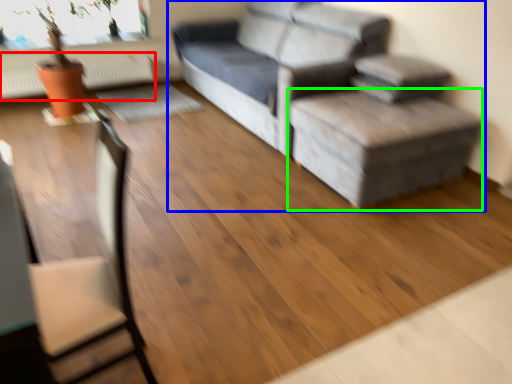
Question: Which object is the closest to the radiator (highlighted by a red box)? Choose among these: studio couch (highlighted by a blue box) or stool (highlighted by a green box).

Choices:
 (A) studio couch
 (B) stool

Answer: (A)